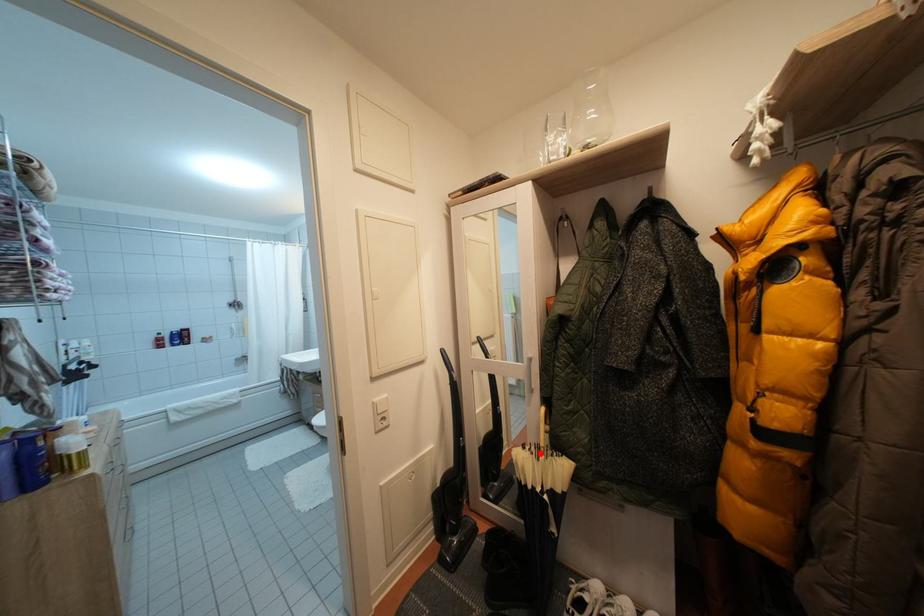
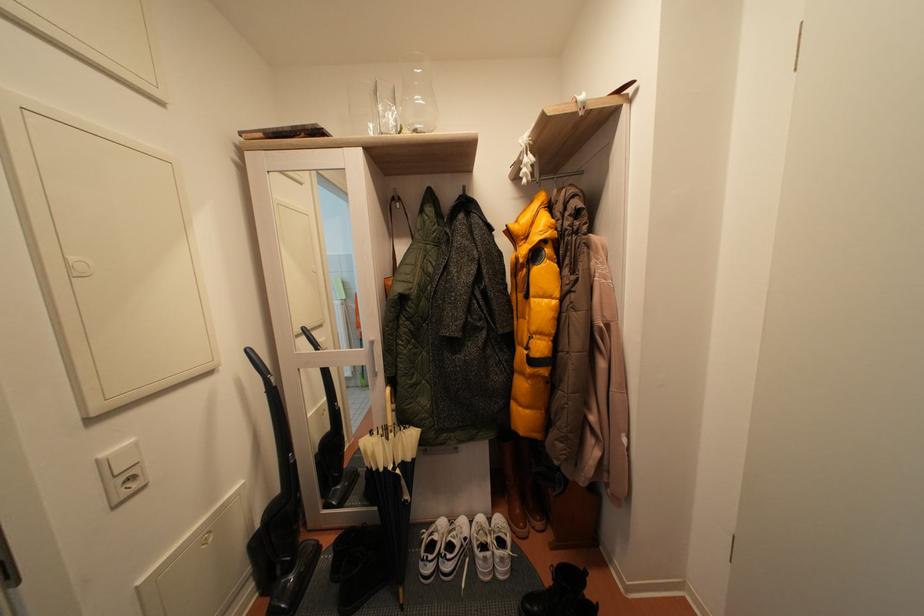
Locate, in the second image, the point that corresponds to the highlighted location in the first image.

(387, 437)